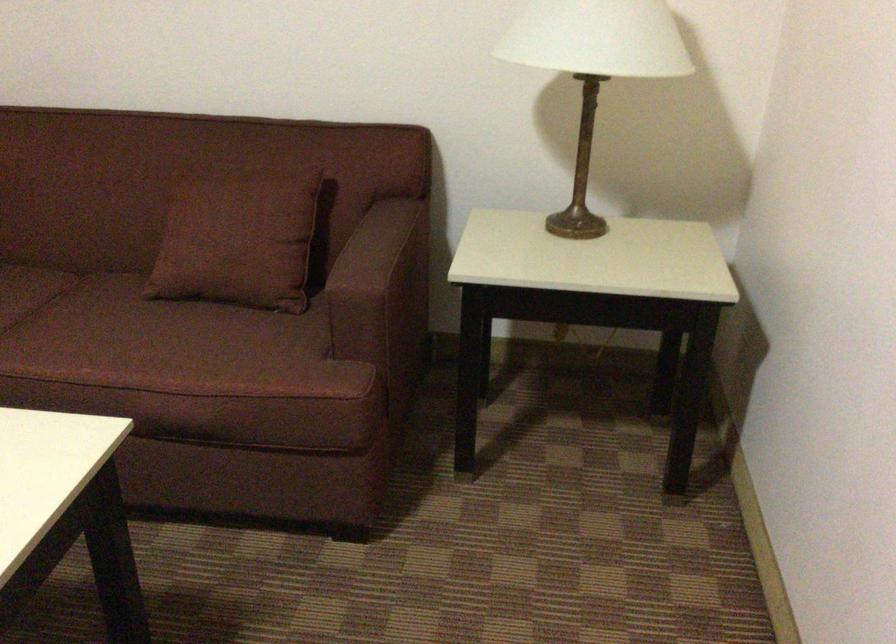
Describe the element at coordinates (135, 339) in the screenshot. The image size is (896, 644). I see `the sofa sitting surface` at that location.